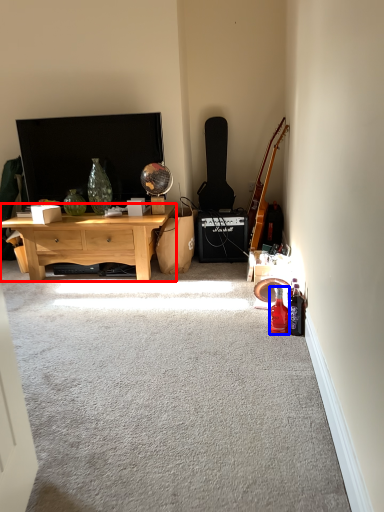
Question: Which object appears closest to the camera in this image, desk (highlighted by a red box) or bottle (highlighted by a blue box)?

Choices:
 (A) desk
 (B) bottle

Answer: (B)